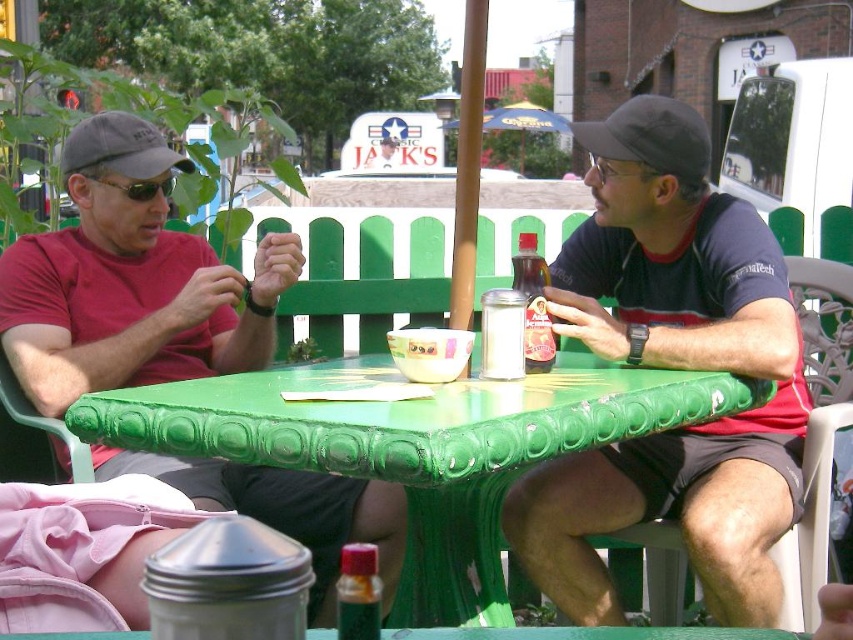
Is matte red shirt at left to the left of green painted plastic table at center from the viewer's perspective?

Indeed, matte red shirt at left is positioned on the left side of green painted plastic table at center.

Between matte red shirt at left and green painted plastic table at center, which one appears on the right side from the viewer's perspective?

Positioned to the right is green painted plastic table at center.

Is point (181, 365) more distant than point (621, 413)?

Yes.

This screenshot has height=640, width=853. In order to click on matte red shirt at left in this screenshot , I will do `click(132, 298)`.

Does matte black shirt at center appear on the right side of green painted plastic table at center?

Yes, matte black shirt at center is to the right of green painted plastic table at center.

Between matte black shirt at center and green painted plastic table at center, which one has more height?

matte black shirt at center

This screenshot has height=640, width=853. What do you see at coordinates (670, 368) in the screenshot? I see `matte black shirt at center` at bounding box center [670, 368].

This screenshot has height=640, width=853. Identify the location of matte black shirt at center. (670, 368).

Is matte black shirt at center bigger than black fabric baseball cap at upper center?

Correct, matte black shirt at center is larger in size than black fabric baseball cap at upper center.

Does matte black shirt at center appear over black fabric baseball cap at upper center?

No, matte black shirt at center is not above black fabric baseball cap at upper center.

Find the location of a particular element. matte black shirt at center is located at coordinates (670, 368).